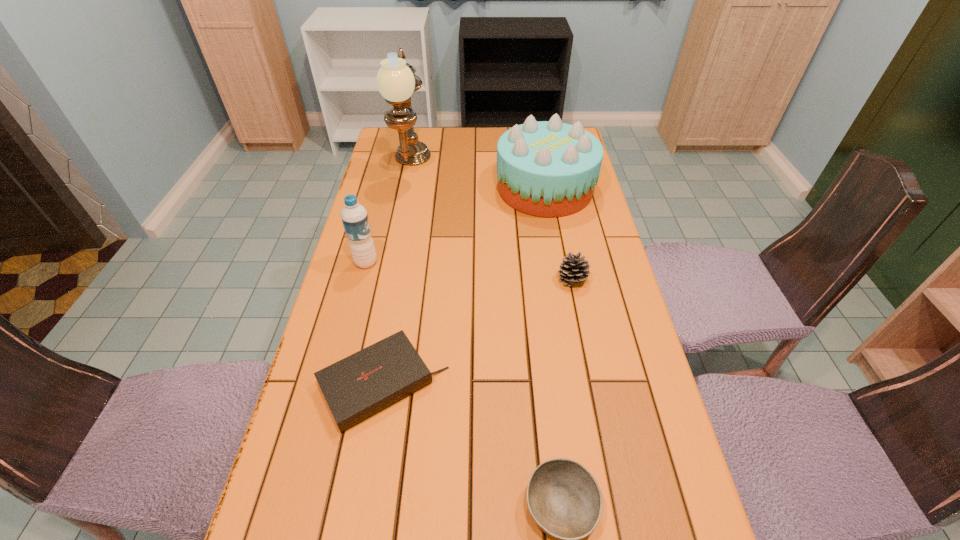
Find the location of a particular element. The image size is (960, 540). oil lamp is located at coordinates (396, 81).

At what (x,y) coordinates should I click in order to perform the action: click on water bottle. Please return your answer as a coordinate pair (x, y). The image size is (960, 540). Looking at the image, I should click on (354, 216).

The height and width of the screenshot is (540, 960). I want to click on cake, so click(548, 168).

Where is `the third shortest object`? The width and height of the screenshot is (960, 540). the third shortest object is located at coordinates (573, 269).

This screenshot has height=540, width=960. I want to click on the shortest object, so click(x=361, y=385).

At what (x,y) coordinates should I click in order to perform the action: click on the second nearest object. Please return your answer as a coordinate pair (x, y). The width and height of the screenshot is (960, 540). Looking at the image, I should click on (361, 385).

Where is `free spot located 0.080m on the right of the tallest object`? free spot located 0.080m on the right of the tallest object is located at coordinates (451, 167).

Locate an element on the screen. This screenshot has width=960, height=540. vacant space located 0.340m on the label of the water bottle is located at coordinates tap(498, 262).

Image resolution: width=960 pixels, height=540 pixels. Find the location of `free spot located 0.360m on the left of the cake`. free spot located 0.360m on the left of the cake is located at coordinates (390, 188).

You are a GUI agent. You are given a task and a screenshot of the screen. Output one action in this format:
    pyautogui.click(x=<x>, y=<y>)
    Task: Click on the free space located on the front of the pinecone
    Image resolution: width=960 pixels, height=540 pixels.
    Given the screenshot: What is the action you would take?
    coord(579,312)